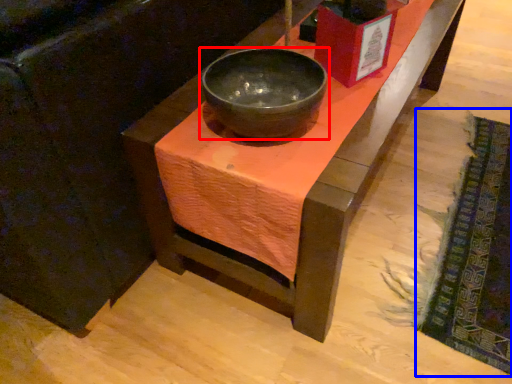
Question: Which of the following is the farthest to the observer, bowl (highlighted by a red box) or mat (highlighted by a blue box)?

Choices:
 (A) bowl
 (B) mat

Answer: (B)